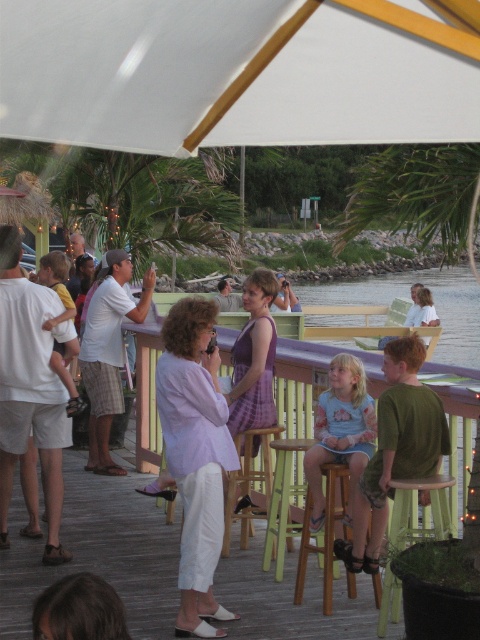
Between light purple fabric shirt at center and wooden bar stool at center, which one appears on the left side from the viewer's perspective?

light purple fabric shirt at center is more to the left.

Between light purple fabric shirt at center and wooden bar stool at center, which one has less height?

wooden bar stool at center is shorter.

Between point (182, 476) and point (249, 509), which one is positioned in front?

Positioned in front is point (182, 476).

You are a GUI agent. You are given a task and a screenshot of the screen. Output one action in this format:
    pyautogui.click(x=<x>, y=<y>)
    Task: Click on the light purple fabric shirt at center
    Image resolution: width=480 pixels, height=640 pixels.
    Given the screenshot: What is the action you would take?
    pyautogui.click(x=194, y=454)

Does light purple fabric shirt at center have a lesser height compared to brown hair at lower left?

In fact, light purple fabric shirt at center may be taller than brown hair at lower left.

Is light purple fabric shirt at center above brown hair at lower left?

Correct, light purple fabric shirt at center is located above brown hair at lower left.

Which is behind, point (171, 380) or point (71, 621)?

Positioned behind is point (171, 380).

This screenshot has width=480, height=640. What are the coordinates of `light purple fabric shirt at center` in the screenshot? It's located at (194, 454).

Which is more to the right, white cotton shirt at left or purple fabric dress at center?

Positioned to the right is purple fabric dress at center.

Who is lower down, white cotton shirt at left or purple fabric dress at center?

white cotton shirt at left

Describe the element at coordinates (31, 388) in the screenshot. The height and width of the screenshot is (640, 480). I see `white cotton shirt at left` at that location.

Where is `white cotton shirt at left`? This screenshot has width=480, height=640. white cotton shirt at left is located at coordinates (31, 388).